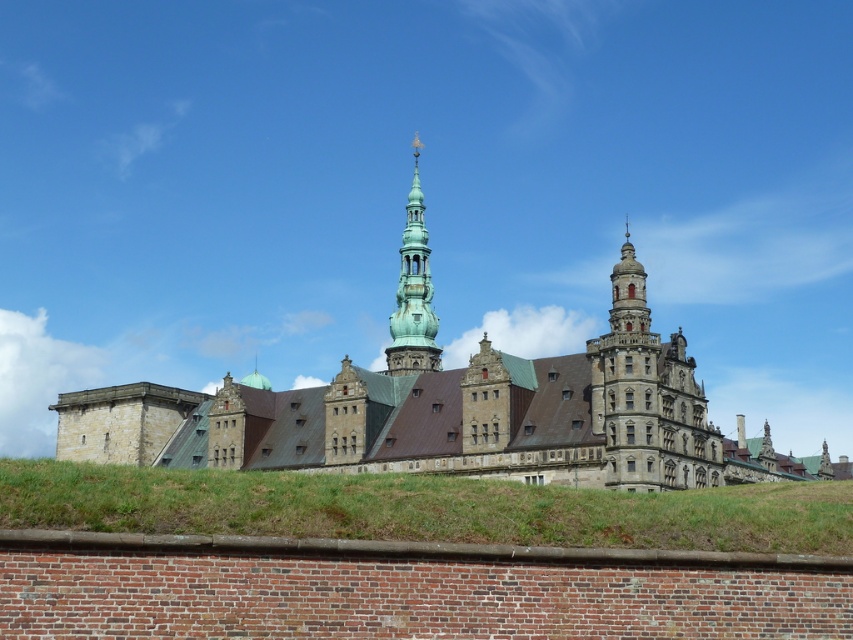
Question: Which of the following is the closest to the observer?

Choices:
 (A) (531, 449)
 (B) (422, 317)

Answer: (A)

Question: Observing the image, what is the correct spatial positioning of green grass at lower center in reference to green copper tower at center?

Choices:
 (A) below
 (B) above

Answer: (A)

Question: Does green grass at lower center appear over green copper tower at center?

Choices:
 (A) yes
 (B) no

Answer: (B)

Question: In this image, where is green grass at lower center located relative to green copper tower at center?

Choices:
 (A) below
 (B) above

Answer: (A)

Question: Which of the following is the closest to the observer?

Choices:
 (A) green copper tower at center
 (B) stone castle at center
 (C) green grass at lower center

Answer: (C)

Question: Among these objects, which one is nearest to the camera?

Choices:
 (A) green copper tower at center
 (B) stone castle at center
 (C) green grass at lower center

Answer: (C)